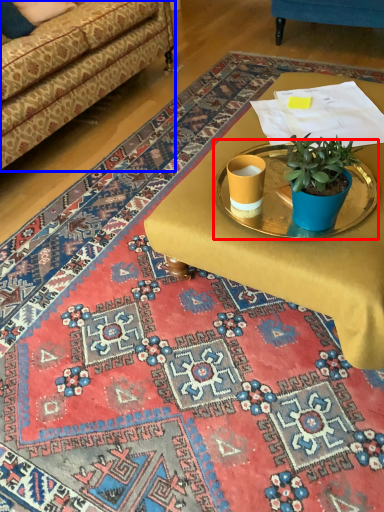
Question: Which object appears closest to the camera in this image, round table (highlighted by a red box) or studio couch (highlighted by a blue box)?

Choices:
 (A) round table
 (B) studio couch

Answer: (A)